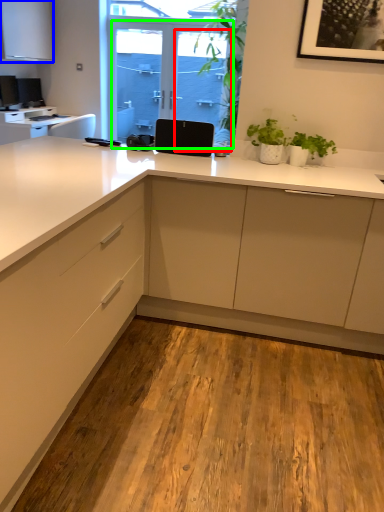
Question: Estimate the real-world distances between objects in this image. Which object is closer to screen door (highlighted by a red box), cabinetry (highlighted by a blue box) or screen door (highlighted by a green box)?

Choices:
 (A) cabinetry
 (B) screen door

Answer: (B)